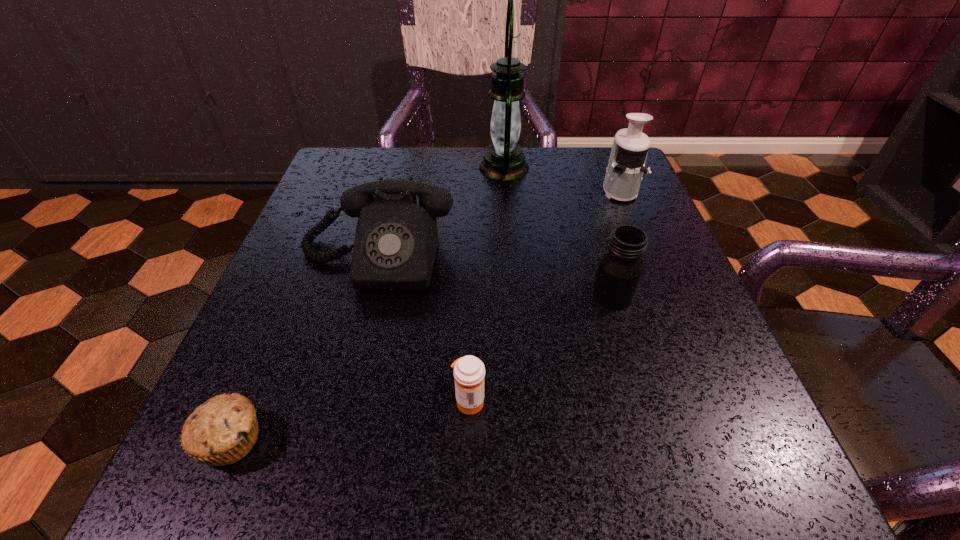
Locate which object is the closest to the telephone. Please provide its 2D coordinates. Your answer should be formatted as a tuple, i.e. [(x, y)], where the tuple contains the x and y coordinates of a point satisfying the conditions above.

[(504, 160)]

Locate an element on the screen. Image resolution: width=960 pixels, height=540 pixels. object that is the fifth nearest to the jar is located at coordinates (221, 431).

The width and height of the screenshot is (960, 540). I want to click on free region that satisfies the following two spatial constraints: 1. on the side where the tallest object emits light; 2. on the right side of the juicer, so click(506, 190).

Where is `vacant space that satisfies the following two spatial constraints: 1. on the dial of the telephone; 2. on the right side of the jar`? vacant space that satisfies the following two spatial constraints: 1. on the dial of the telephone; 2. on the right side of the jar is located at coordinates (367, 293).

Where is `free space that satisfies the following two spatial constraints: 1. on the side where the lantern emits light; 2. on the front side of the fifth tallest object`? free space that satisfies the following two spatial constraints: 1. on the side where the lantern emits light; 2. on the front side of the fifth tallest object is located at coordinates (521, 401).

You are a GUI agent. You are given a task and a screenshot of the screen. Output one action in this format:
    pyautogui.click(x=<x>, y=<y>)
    Task: Click on the vacant area in the image that satisfies the following two spatial constraints: 1. on the side where the lantern emits light; 2. on the back side of the juicer
    
    Given the screenshot: What is the action you would take?
    pyautogui.click(x=506, y=190)